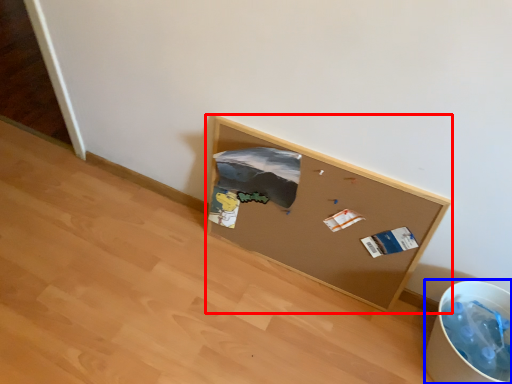
Question: Which of the following is the farthest to the observer, furniture (highlighted by a red box) or recycling bin (highlighted by a blue box)?

Choices:
 (A) furniture
 (B) recycling bin

Answer: (A)